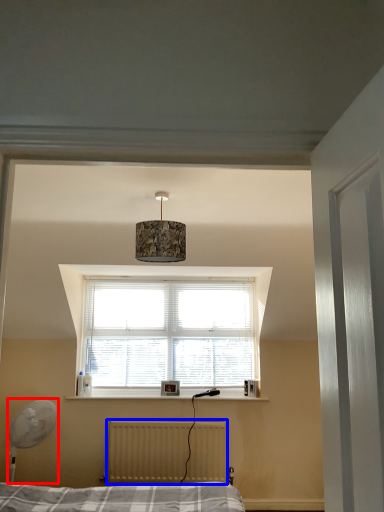
Question: Which of the following is the farthest to the observer, table lamp (highlighted by a red box) or radiator (highlighted by a blue box)?

Choices:
 (A) table lamp
 (B) radiator

Answer: (B)